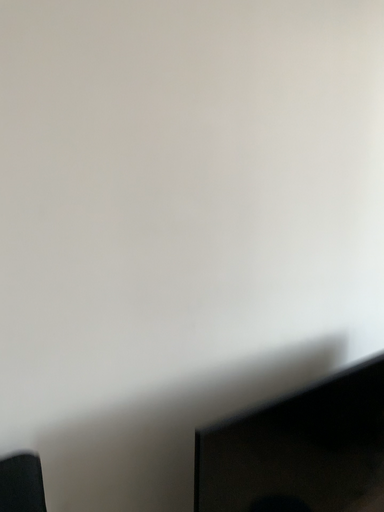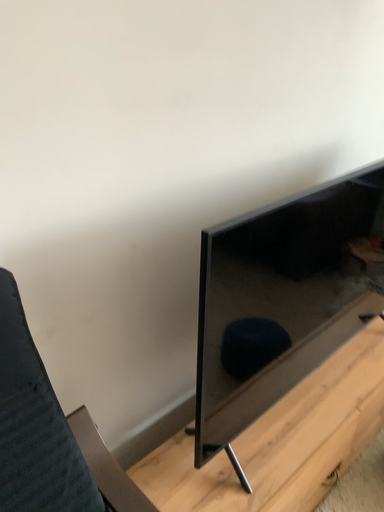
Question: Which way did the camera rotate in the video?

Choices:
 (A) rotated left
 (B) rotated right

Answer: (B)